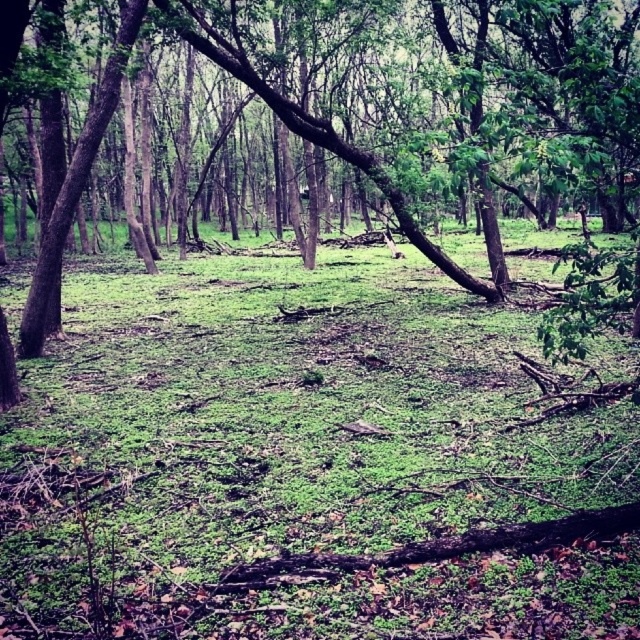
Question: Where is green mossy ground at center located in relation to green leafy tree at center in the image?

Choices:
 (A) above
 (B) below

Answer: (B)

Question: Where is green mossy ground at center located in relation to green leafy tree at center in the image?

Choices:
 (A) right
 (B) left

Answer: (B)

Question: Does green mossy ground at center appear on the left side of green leafy tree at center?

Choices:
 (A) yes
 (B) no

Answer: (A)

Question: Among these objects, which one is nearest to the camera?

Choices:
 (A) green leafy tree at center
 (B) green mossy ground at center

Answer: (A)

Question: Which object is farther from the camera taking this photo?

Choices:
 (A) green mossy ground at center
 (B) green leafy tree at center

Answer: (A)

Question: Which of the following is the closest to the observer?

Choices:
 (A) green leafy tree at center
 (B) green mossy ground at center

Answer: (A)